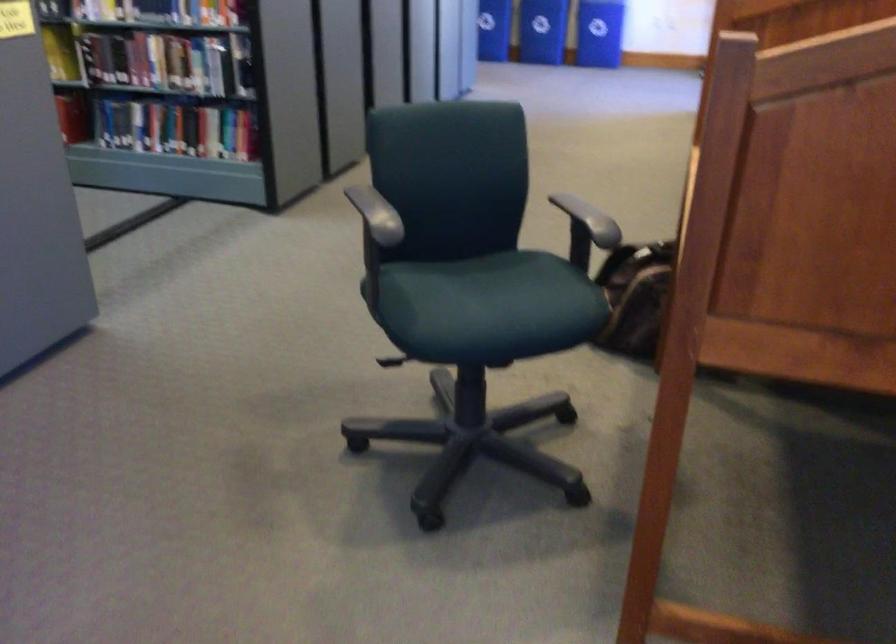
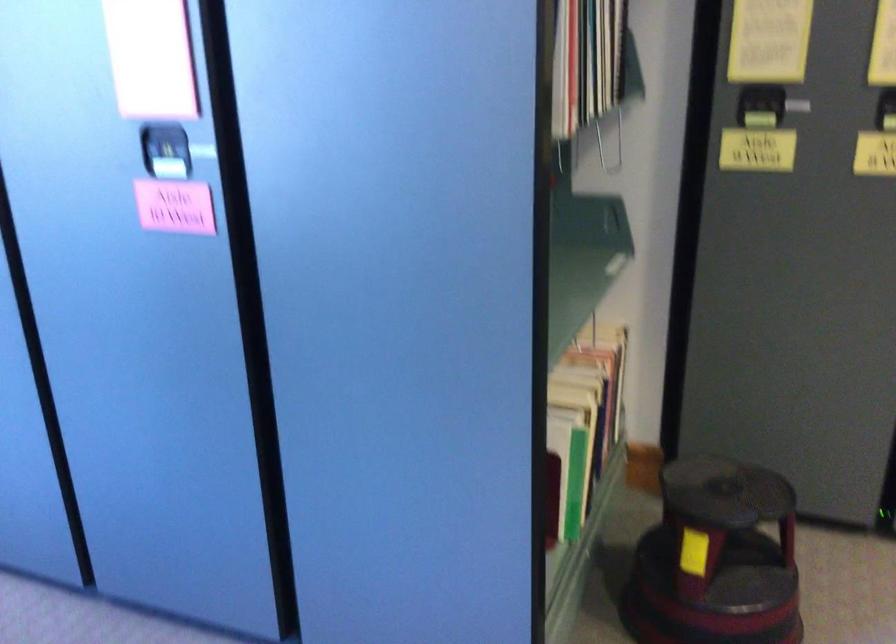
The first image is from the beginning of the video and the second image is from the end. How did the camera likely rotate when shooting the video?

The camera rotated toward left-down.